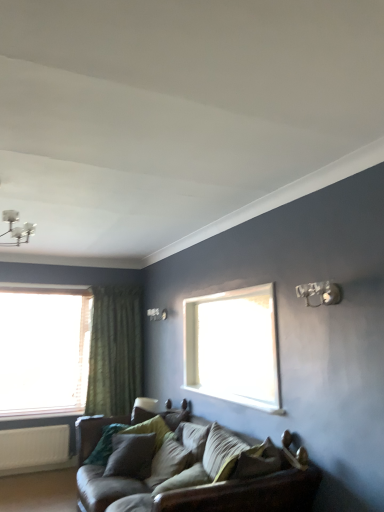
Question: From a real-world perspective, is velvet green pillow at center, which is the first pillow in back-to-front order, physically above leather couch at lower center?

Choices:
 (A) no
 (B) yes

Answer: (B)

Question: Considering the relative sizes of velvet green pillow at center, which is counted as the third pillow, starting from the front, and leather couch at lower center in the image provided, is velvet green pillow at center, which is counted as the third pillow, starting from the front, shorter than leather couch at lower center?

Choices:
 (A) yes
 (B) no

Answer: (A)

Question: Is velvet green pillow at center, which is counted as the third pillow, starting from the front, touching leather couch at lower center?

Choices:
 (A) yes
 (B) no

Answer: (B)

Question: Is leather couch at lower center a part of velvet green pillow at center, which is the first pillow in back-to-front order?

Choices:
 (A) no
 (B) yes

Answer: (A)

Question: Does velvet green pillow at center, which is counted as the third pillow, starting from the front, have a greater width compared to leather couch at lower center?

Choices:
 (A) yes
 (B) no

Answer: (B)

Question: From the image's perspective, is velvet green pillow at center, which is counted as the third pillow, starting from the front, above leather couch at lower center?

Choices:
 (A) yes
 (B) no

Answer: (A)

Question: Could you tell me if velvet green pillow at center, which appears as the second pillow when viewed from the front, is turned towards white matte radiator at lower left?

Choices:
 (A) yes
 (B) no

Answer: (B)

Question: Considering the relative sizes of velvet green pillow at center, which appears as the second pillow when viewed from the front, and white matte radiator at lower left in the image provided, is velvet green pillow at center, which appears as the second pillow when viewed from the front, shorter than white matte radiator at lower left?

Choices:
 (A) no
 (B) yes

Answer: (B)

Question: Is velvet green pillow at center, which appears as the second pillow when viewed from the front, surrounding white matte radiator at lower left?

Choices:
 (A) yes
 (B) no

Answer: (B)

Question: From a real-world perspective, is velvet green pillow at center, which appears as the second pillow when viewed from the back, on white matte radiator at lower left?

Choices:
 (A) no
 (B) yes

Answer: (B)

Question: Can you confirm if velvet green pillow at center, which appears as the second pillow when viewed from the front, is positioned to the right of white matte radiator at lower left?

Choices:
 (A) no
 (B) yes

Answer: (B)

Question: From the image's perspective, would you say velvet green pillow at center, which appears as the second pillow when viewed from the front, is shown under white matte radiator at lower left?

Choices:
 (A) no
 (B) yes

Answer: (A)

Question: Is the depth of green textured curtain at left greater than that of metallic silver light fixture at upper right?

Choices:
 (A) yes
 (B) no

Answer: (A)